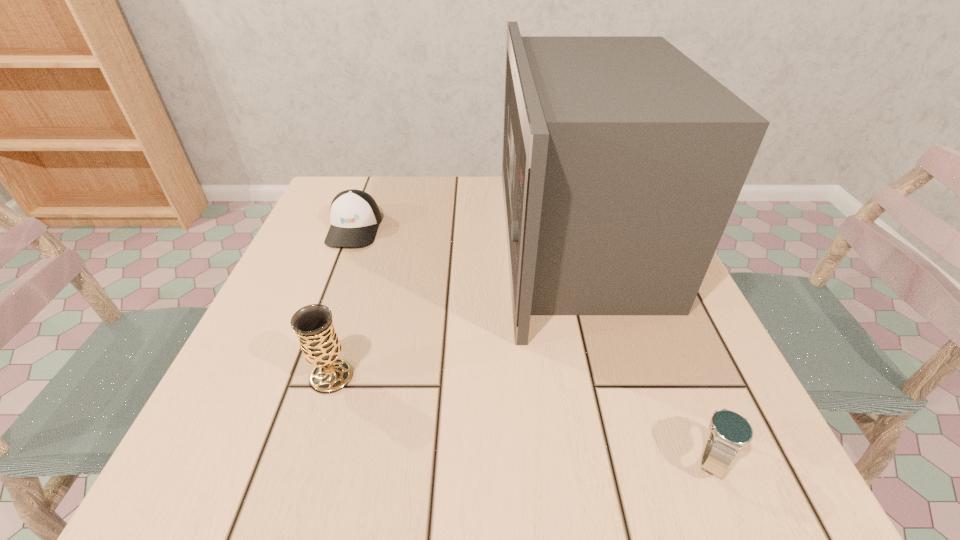
Image resolution: width=960 pixels, height=540 pixels. Find the location of `free space located on the back of the nearest object`. free space located on the back of the nearest object is located at coordinates pos(631,260).

Locate an element on the screen. This screenshot has width=960, height=540. microwave oven that is at the far edge is located at coordinates (623, 159).

The height and width of the screenshot is (540, 960). What are the coordinates of `cap located at the far edge` in the screenshot? It's located at 354,215.

Where is `object positioned at the near edge`? The image size is (960, 540). object positioned at the near edge is located at coordinates (730, 431).

You are a GUI agent. You are given a task and a screenshot of the screen. Output one action in this format:
    pyautogui.click(x=<x>, y=<y>)
    Task: Click on the chalice that is at the left edge
    
    Given the screenshot: What is the action you would take?
    pyautogui.click(x=313, y=324)

You are a GUI agent. You are given a task and a screenshot of the screen. Output one action in this format:
    pyautogui.click(x=<x>, y=<y>)
    Task: Click on the cap that is positioned at the left edge
    The width and height of the screenshot is (960, 540).
    Given the screenshot: What is the action you would take?
    pyautogui.click(x=354, y=215)

This screenshot has width=960, height=540. In order to click on microwave oven at the right edge in this screenshot , I will do `click(623, 159)`.

Find the location of `watch located at the right edge`. watch located at the right edge is located at coordinates (730, 431).

I want to click on object situated at the far left corner, so click(354, 215).

Identify the location of object at the far right corner. Image resolution: width=960 pixels, height=540 pixels. (623, 159).